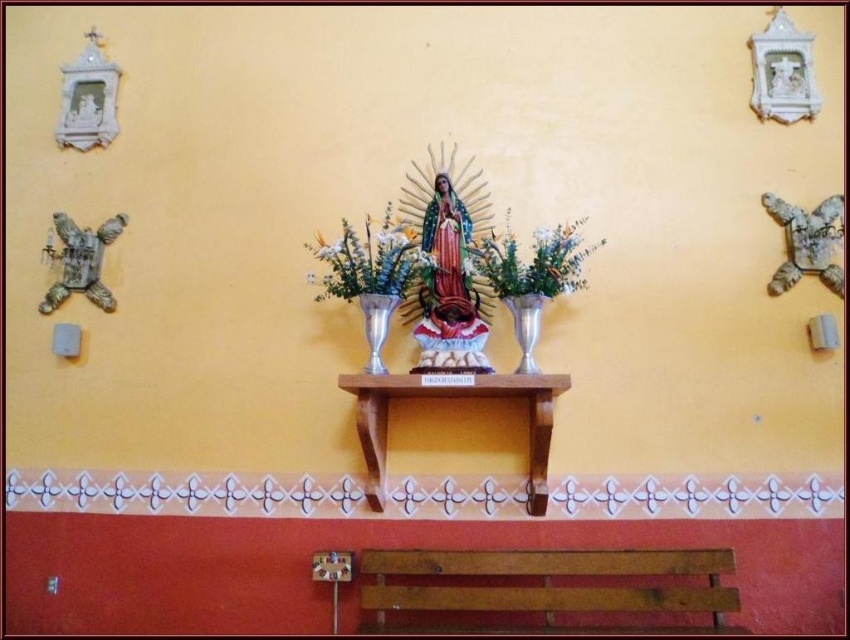
Consider the image. You are standing in front of the church wall and want to touch both points mentioned. Which point should you reach for first, the point at coordinate (406, 237) or the point at coordinate (524, 266)?

You should reach for point (406, 237) first because it is closer to you than point (524, 266), which is further away.

You are standing in the church and want to place a bouquet of fresh flowers on the wooden shelf at center. Considering your height and arm reach, you can only reach up to 1.8 meters. Can you place the bouquet on the shelf without any assistance?

The wooden shelf at center is 3.23 meters away from viewer, which is much higher than your maximum reach of 1.8 meters. You will need assistance to place the bouquet on the shelf.